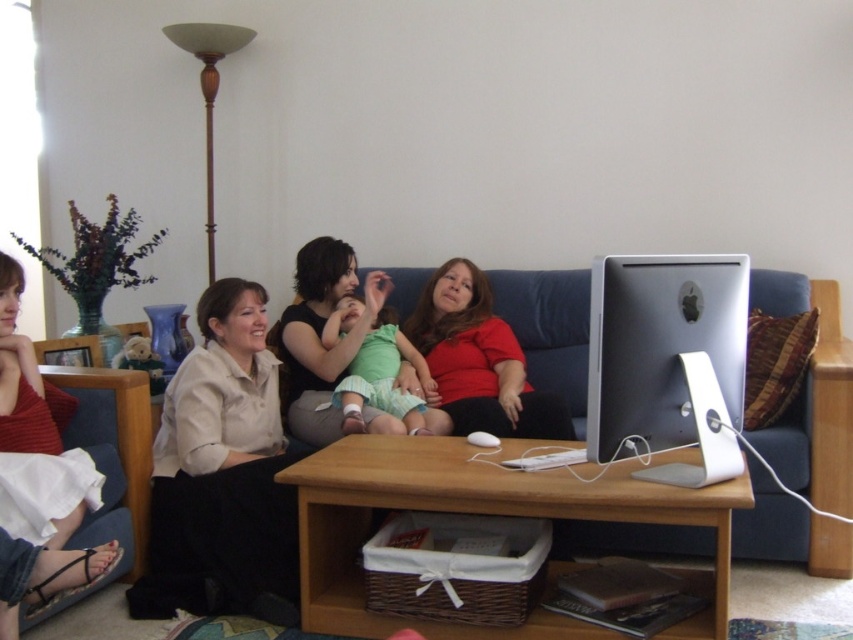
Based on the photo, does sleek silver monitor at center appear over matte black shirt at center?

Incorrect, sleek silver monitor at center is not positioned above matte black shirt at center.

The width and height of the screenshot is (853, 640). I want to click on sleek silver monitor at center, so click(666, 362).

Locate an element on the screen. This screenshot has height=640, width=853. sleek silver monitor at center is located at coordinates (666, 362).

Image resolution: width=853 pixels, height=640 pixels. Describe the element at coordinates (666, 362) in the screenshot. I see `sleek silver monitor at center` at that location.

Is sleek silver monitor at center shorter than matte red shirt at center?

Indeed, sleek silver monitor at center has a lesser height compared to matte red shirt at center.

Describe the element at coordinates (666, 362) in the screenshot. Image resolution: width=853 pixels, height=640 pixels. I see `sleek silver monitor at center` at that location.

Identify the location of sleek silver monitor at center. The height and width of the screenshot is (640, 853). (666, 362).

Between matte red shirt at center and matte black shirt at center, which one is positioned higher?

matte black shirt at center is higher up.

Can you confirm if matte red shirt at center is positioned to the left of matte black shirt at center?

Incorrect, matte red shirt at center is not on the left side of matte black shirt at center.

Where is `matte red shirt at center`? Image resolution: width=853 pixels, height=640 pixels. matte red shirt at center is located at coordinates (479, 360).